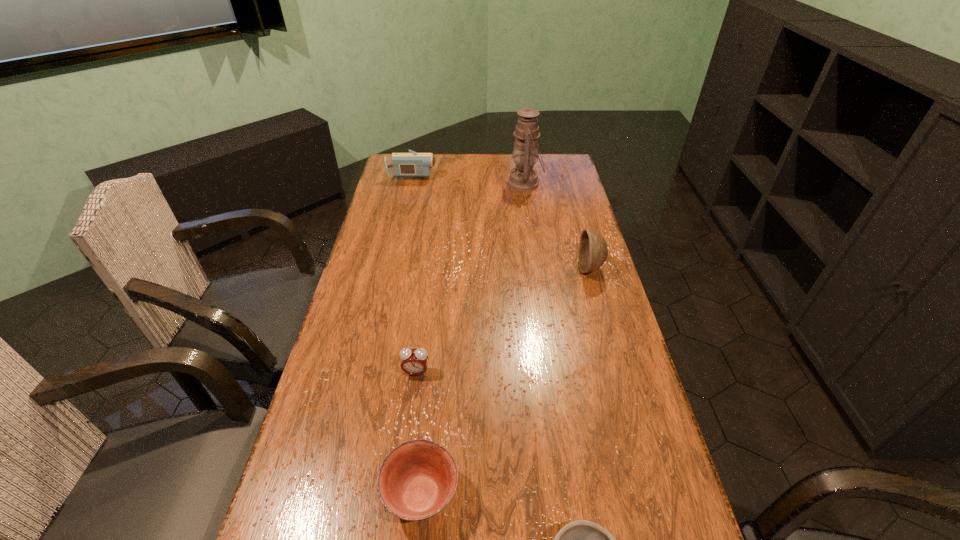
This screenshot has height=540, width=960. What are the coordinates of `free location at the left edge of the desktop` in the screenshot? It's located at (373, 303).

Locate an element on the screen. The height and width of the screenshot is (540, 960). free region at the right edge is located at coordinates (586, 219).

Find the location of `vacant area that lies between the alarm clock and the camcorder`. vacant area that lies between the alarm clock and the camcorder is located at coordinates (x=415, y=273).

You are a GUI agent. You are given a task and a screenshot of the screen. Output one action in this format:
    pyautogui.click(x=<x>, y=<y>)
    Task: Click on the unoccupied area between the fifth tallest object and the tallest object
    The height and width of the screenshot is (540, 960).
    Given the screenshot: What is the action you would take?
    pyautogui.click(x=473, y=339)

Find the location of a particular element. This screenshot has height=540, width=960. empty space between the second shortest bowl and the tallest object is located at coordinates (473, 339).

This screenshot has height=540, width=960. I want to click on free space between the tallest object and the second shortest object, so click(x=473, y=339).

Where is `vacant region between the oil lamp and the camcorder`? The width and height of the screenshot is (960, 540). vacant region between the oil lamp and the camcorder is located at coordinates click(469, 178).

Image resolution: width=960 pixels, height=540 pixels. I want to click on vacant point located between the tallest bowl and the leftmost bowl, so click(x=506, y=382).

In order to click on object that can be found as the third closest to the second shortest bowl in this screenshot , I will do `click(593, 250)`.

Where is `object that ranks as the fourth closest to the shortest object`? This screenshot has width=960, height=540. object that ranks as the fourth closest to the shortest object is located at coordinates (523, 178).